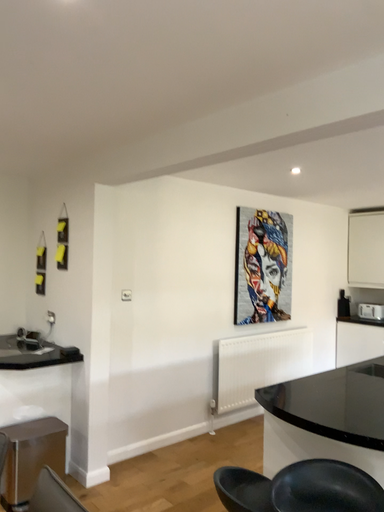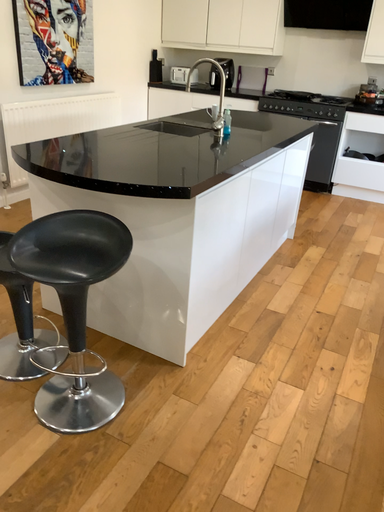
Question: How did the camera likely rotate when shooting the video?

Choices:
 (A) rotated downward
 (B) rotated upward

Answer: (A)